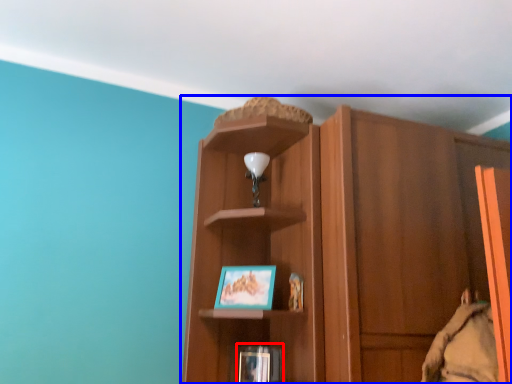
Question: Which of the following is the farthest to the observer, book (highlighted by a red box) or cupboard (highlighted by a blue box)?

Choices:
 (A) book
 (B) cupboard

Answer: (A)